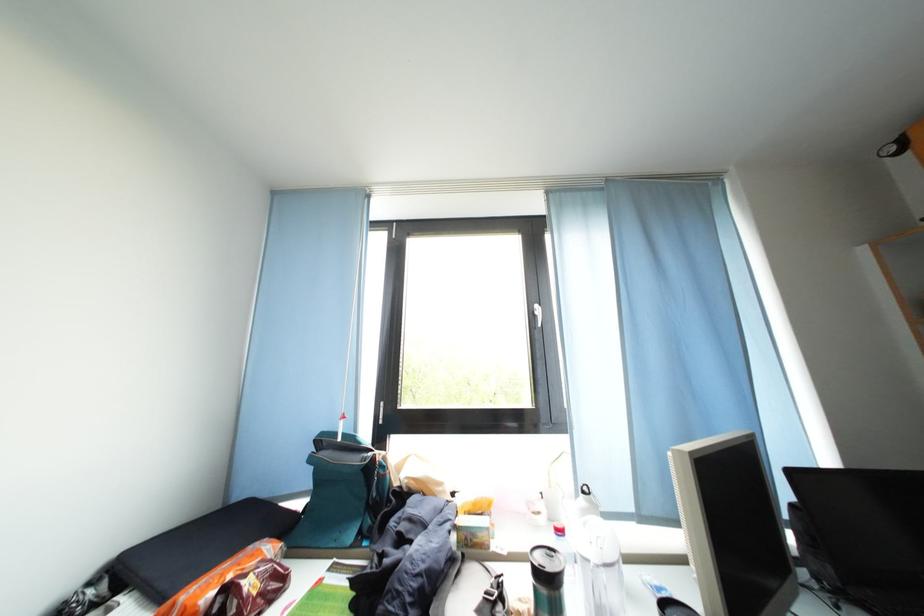
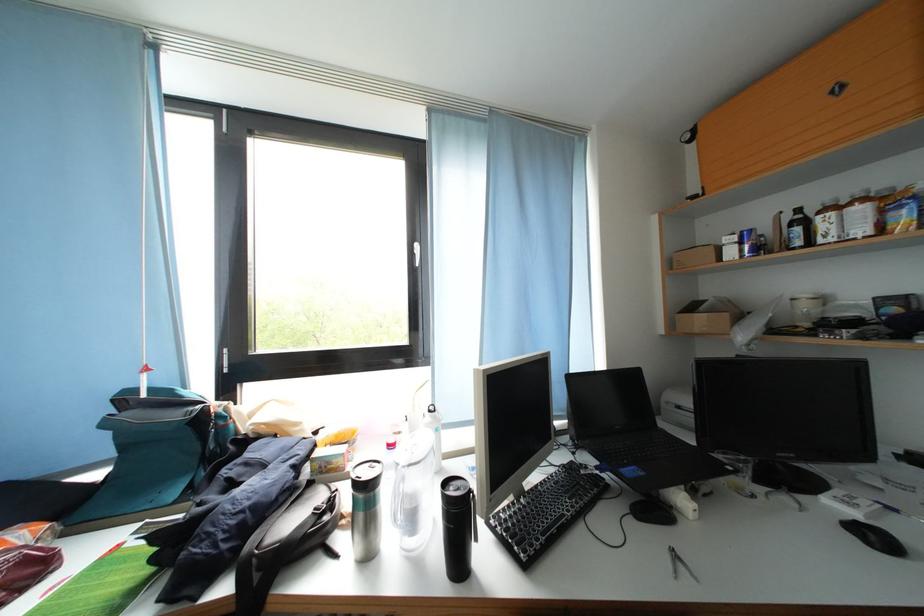
In the second image, find the point that corresponds to the point at 568,537 in the first image.

(398, 451)